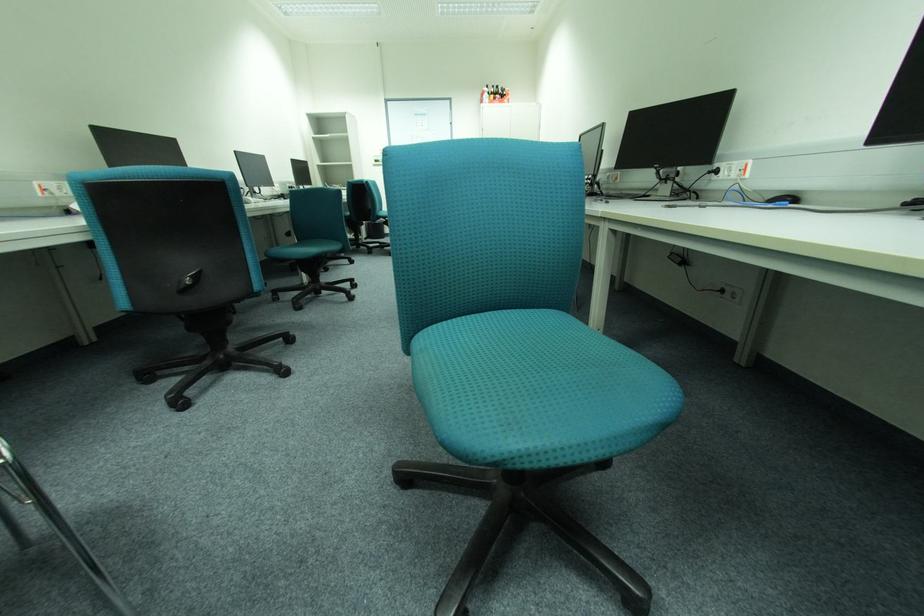
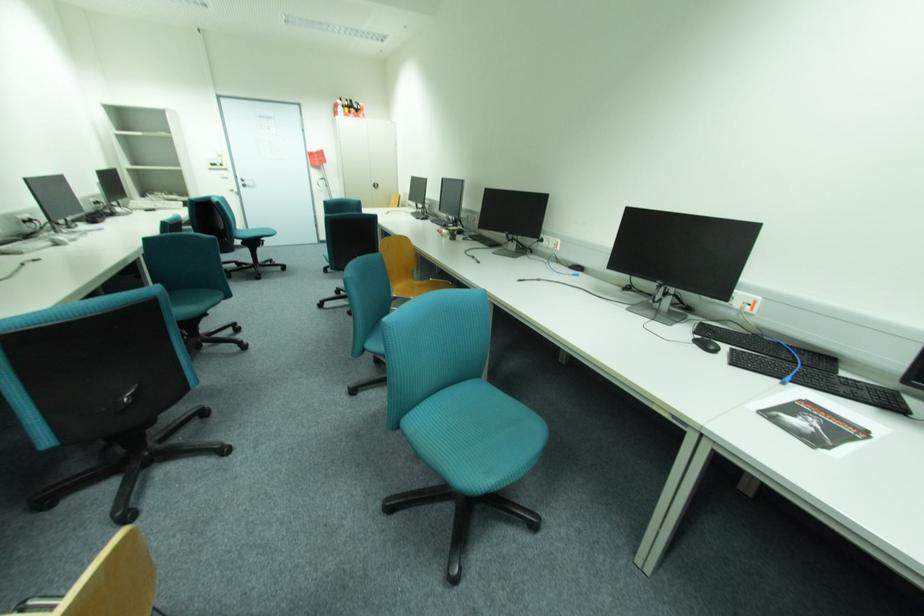
The point at (718, 176) is marked in the first image. Where is the corresponding point in the second image?

(544, 243)